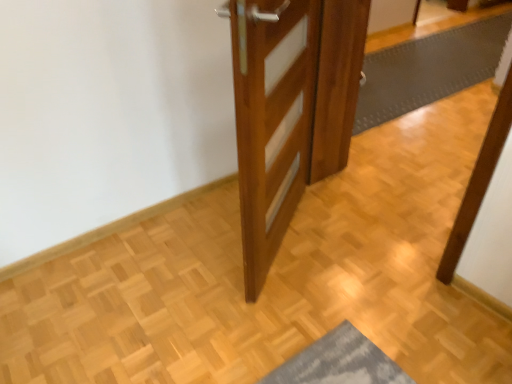
Question: Looking at their shapes, would you say wooden door at center is wider or thinner than gray rubber bath mat at center?

Choices:
 (A) thin
 (B) wide

Answer: (A)

Question: From their relative heights in the image, would you say wooden door at center is taller or shorter than gray rubber bath mat at center?

Choices:
 (A) tall
 (B) short

Answer: (A)

Question: Is wooden door at center bigger or smaller than gray rubber bath mat at center?

Choices:
 (A) big
 (B) small

Answer: (B)

Question: Is gray rubber bath mat at center taller or shorter than wooden door at center?

Choices:
 (A) tall
 (B) short

Answer: (B)

Question: In the image, is gray rubber bath mat at center positioned in front of or behind wooden door at center?

Choices:
 (A) behind
 (B) front

Answer: (A)

Question: Looking at their shapes, would you say gray rubber bath mat at center is wider or thinner than wooden door at center?

Choices:
 (A) wide
 (B) thin

Answer: (A)

Question: Is point (480, 76) positioned closer to the camera than point (356, 91)?

Choices:
 (A) farther
 (B) closer

Answer: (A)